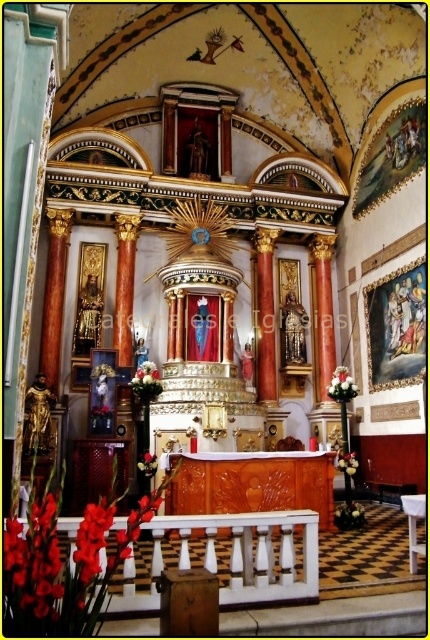
Question: Which object is closer to the camera taking this photo?

Choices:
 (A) white matte flower at lower center
 (B) white silk flowers at right

Answer: (A)

Question: Does white matte flower at lower center appear over white matte vase at center?

Choices:
 (A) yes
 (B) no

Answer: (B)

Question: Which object is closer to the camera taking this photo?

Choices:
 (A) white matte vase at center
 (B) shiny red petals at lower left

Answer: (B)

Question: Which point appears closest to the camera in this image?

Choices:
 (A) (25, 538)
 (B) (328, 385)
 (C) (144, 454)
 (D) (344, 461)

Answer: (A)

Question: Observing the image, what is the correct spatial positioning of white silk flowers at right in reference to white matte vase at center?

Choices:
 (A) above
 (B) below

Answer: (A)

Question: Can you confirm if white matte flower at lower center is positioned above white matte vase at center?

Choices:
 (A) no
 (B) yes

Answer: (A)